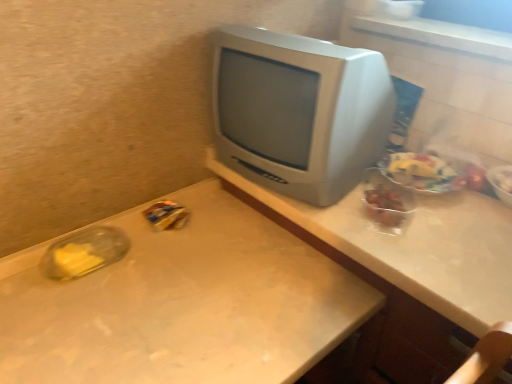
Question: Can you confirm if matte gray computer desk at center is smaller than satin silver monitor at center?

Choices:
 (A) yes
 (B) no

Answer: (B)

Question: Is matte gray computer desk at center wider than satin silver monitor at center?

Choices:
 (A) no
 (B) yes

Answer: (B)

Question: Is matte gray computer desk at center directly adjacent to satin silver monitor at center?

Choices:
 (A) yes
 (B) no

Answer: (B)

Question: Considering the relative sizes of matte gray computer desk at center and satin silver monitor at center in the image provided, is matte gray computer desk at center taller than satin silver monitor at center?

Choices:
 (A) yes
 (B) no

Answer: (A)

Question: Is satin silver monitor at center at the back of matte gray computer desk at center?

Choices:
 (A) yes
 (B) no

Answer: (B)

Question: Based on their sizes in the image, would you say translucent plastic bowl at upper right, the 1th food in the right-to-left sequence, is bigger or smaller than translucent plastic bag at right, which is the 2th food in right-to-left order?

Choices:
 (A) small
 (B) big

Answer: (A)

Question: Is translucent plastic bowl at upper right, the 1th food in the right-to-left sequence, taller or shorter than translucent plastic bag at right, which is the 2th food in right-to-left order?

Choices:
 (A) short
 (B) tall

Answer: (A)

Question: Looking at their shapes, would you say translucent plastic bowl at upper right, the fourth food in the left-to-right sequence, is wider or thinner than translucent plastic bag at right, which is the third food in left-to-right order?

Choices:
 (A) thin
 (B) wide

Answer: (A)

Question: Is translucent plastic bowl at upper right, the fourth food in the left-to-right sequence, situated inside translucent plastic bag at right, which is the 2th food in right-to-left order, or outside?

Choices:
 (A) outside
 (B) inside

Answer: (A)

Question: From a real-world perspective, is white matte desk at center above or below translucent plastic container at right, which is counted as the third food, starting from the right?

Choices:
 (A) below
 (B) above

Answer: (A)

Question: Is point (130, 235) closer or farther from the camera than point (395, 218)?

Choices:
 (A) closer
 (B) farther

Answer: (B)

Question: Based on their sizes in the image, would you say white matte desk at center is bigger or smaller than translucent plastic container at right, which is counted as the third food, starting from the right?

Choices:
 (A) big
 (B) small

Answer: (A)

Question: From the image's perspective, is white matte desk at center located above or below translucent plastic container at right, which appears as the 2th food when viewed from the left?

Choices:
 (A) below
 (B) above

Answer: (A)

Question: Considering the positions of translucent plastic bag at right, which is the 2th food in right-to-left order, and white matte desk at center in the image, is translucent plastic bag at right, which is the 2th food in right-to-left order, bigger or smaller than white matte desk at center?

Choices:
 (A) small
 (B) big

Answer: (A)

Question: From a real-world perspective, is translucent plastic bag at right, which is the 2th food in right-to-left order, physically located above or below white matte desk at center?

Choices:
 (A) above
 (B) below

Answer: (A)